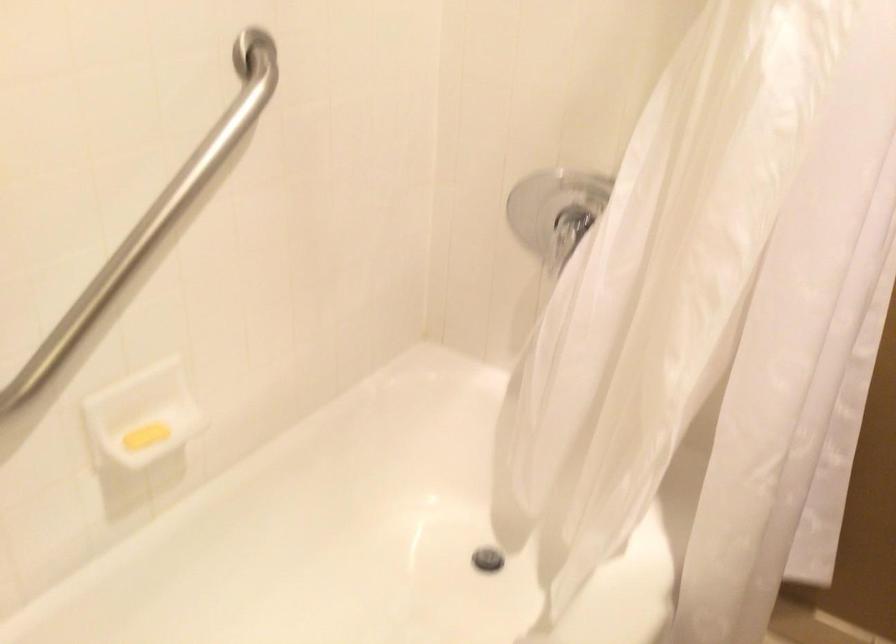
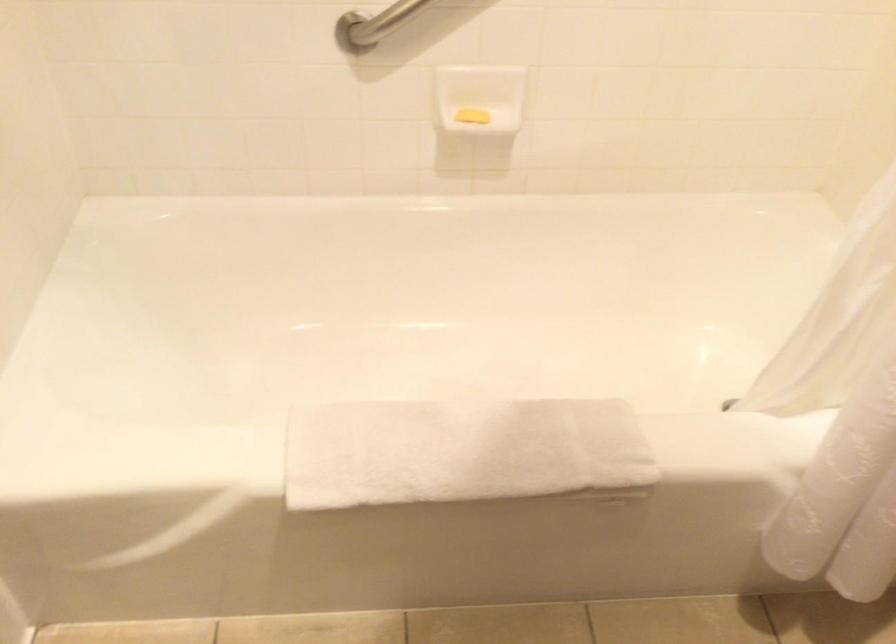
Where in the second image is the point corresponding to [152,436] from the first image?

(471, 116)